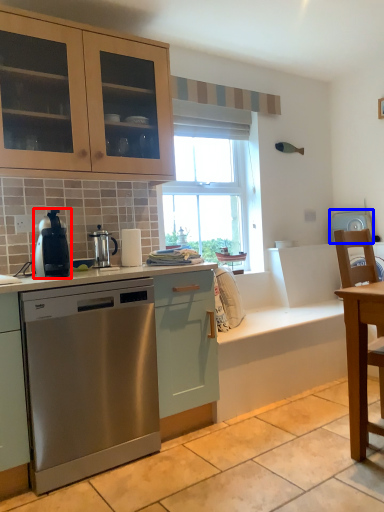
Question: Which object is closer to the camera taking this photo, home appliance (highlighted by a red box) or appliance (highlighted by a blue box)?

Choices:
 (A) home appliance
 (B) appliance

Answer: (A)